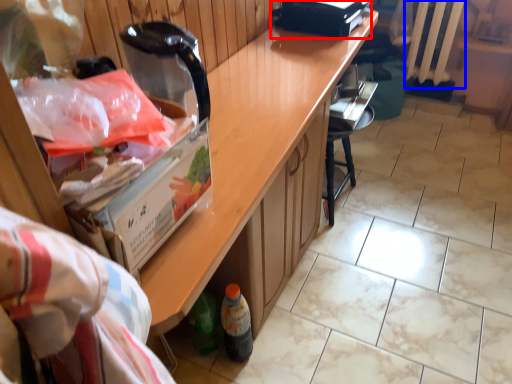
Question: Which object appears closest to the camera in this image, appliance (highlighted by a red box) or radiator (highlighted by a blue box)?

Choices:
 (A) appliance
 (B) radiator

Answer: (A)